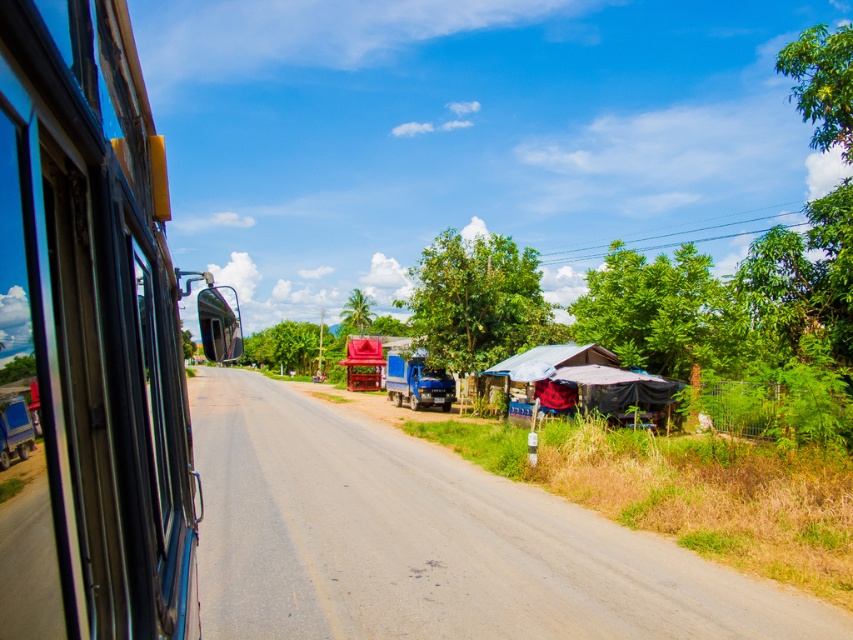
Question: Estimate the real-world distances between objects in this image. Which object is farther from the blue glass train window at left?

Choices:
 (A) brown dirt track at lower right
 (B) rusty corrugated hut at right

Answer: (B)

Question: Does blue glass train window at left appear on the left side of rusty corrugated hut at right?

Choices:
 (A) yes
 (B) no

Answer: (A)

Question: Which object is farther from the camera taking this photo?

Choices:
 (A) rusty corrugated hut at right
 (B) blue glass train window at left

Answer: (A)

Question: Can you confirm if blue glass train window at left is wider than brown dirt track at lower right?

Choices:
 (A) no
 (B) yes

Answer: (A)

Question: Is blue glass train window at left smaller than brown dirt track at lower right?

Choices:
 (A) yes
 (B) no

Answer: (A)

Question: Which of the following is the farthest from the observer?

Choices:
 (A) brown dirt track at lower right
 (B) rusty corrugated hut at right

Answer: (B)